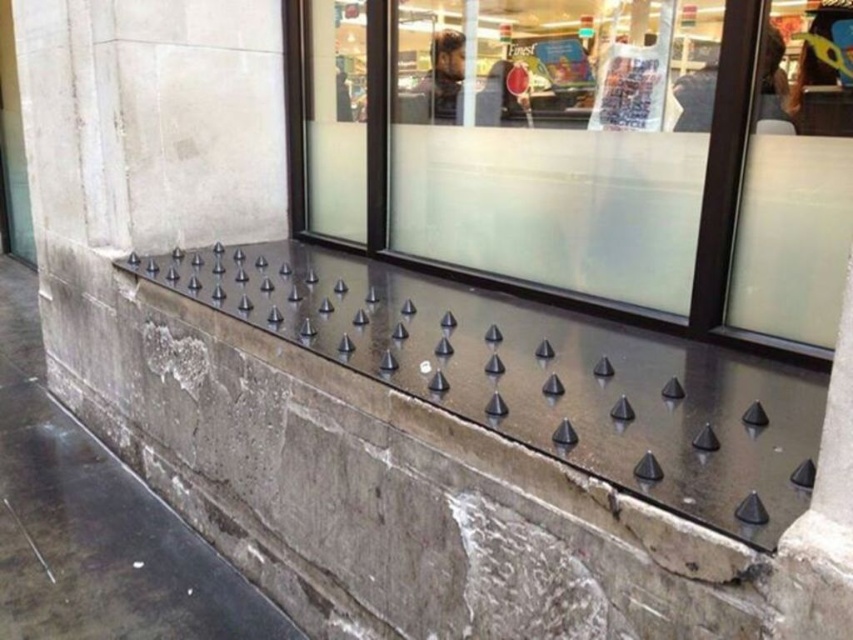
Based on the photo, you are a delivery person trying to place a package on the wall between the transparent glass at center and the black rubber spikes at upper center. Can the package fit horizontally between them?

The transparent glass at center has a lesser width compared to black rubber spikes at upper center. Since the package needs to fit between them, the width of the transparent glass at center is narrower, so the package may not fit if it is wider than the transparent glass at center.

You are a window installer assessing the exterior wall. You see the transparent glass at center and the black rubber spikes at upper center. Which object takes up more space in the scene?

The black rubber spikes at upper center take up more space in the scene because the transparent glass at center is smaller than them.

In the scene shown: You are a window installer checking the dimensions of the transparent glass at center and the black rubber spikes at upper center. Which object is taller?

The transparent glass at center has a greater height compared to the black rubber spikes at upper center, so the transparent glass at center is taller.